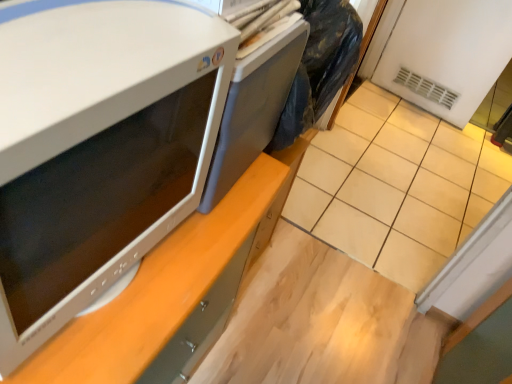
This screenshot has width=512, height=384. Describe the element at coordinates (97, 147) in the screenshot. I see `white glossy microwave at left` at that location.

Where is `beige tile at lower right`? This screenshot has height=384, width=512. beige tile at lower right is located at coordinates (396, 186).

How different are the orientations of satin gray desktop at center and beige tile at lower right in degrees?

There is a 89.8-degree angle between the facing directions of satin gray desktop at center and beige tile at lower right.

Can you confirm if satin gray desktop at center is smaller than beige tile at lower right?

Yes.

Which point is more distant from viewer, (211,163) or (329,192)?

Positioned behind is point (329,192).

Can beige tile at lower right be found inside satin gray desktop at center?

No, beige tile at lower right is not inside satin gray desktop at center.

Is white glossy microwave at left situated inside beige tile at lower right or outside?

white glossy microwave at left is not enclosed by beige tile at lower right.

Is point (9, 115) closer to camera compared to point (445, 191)?

Yes, it is in front of point (445, 191).

Between white glossy microwave at left and beige tile at lower right, which one has larger width?

Wider between the two is white glossy microwave at left.

Consider the image. Is white glossy microwave at left positioned behind beige tile at lower right?

No.

Between white glossy microwave at left and satin gray desktop at center, which one has larger width?

satin gray desktop at center is wider.

Is white glossy microwave at left turned away from satin gray desktop at center?

No, satin gray desktop at center is not at the back of white glossy microwave at left.

Which object is closer to the camera, white glossy microwave at left or satin gray desktop at center?

white glossy microwave at left.

Is beige tile at lower right far away from satin gray desktop at center?

beige tile at lower right is positioned a significant distance from satin gray desktop at center.

In the scene shown: Considering the relative sizes of beige tile at lower right and satin gray desktop at center in the image provided, is beige tile at lower right smaller than satin gray desktop at center?

No, beige tile at lower right is not smaller than satin gray desktop at center.

From a real-world perspective, is beige tile at lower right positioned under satin gray desktop at center based on gravity?

Yes, from a real-world perspective, beige tile at lower right is under satin gray desktop at center.

Considering the positions of points (284, 98) and (78, 3), is point (284, 98) closer to camera compared to point (78, 3)?

No, it is not.

Locate an element on the screen. desktop below the white glossy microwave at left (from a real-world perspective) is located at coordinates (253, 109).

Which object is more forward, satin gray desktop at center or white glossy microwave at left?

white glossy microwave at left.

Considering the positions of objects beige tile at lower right and white glossy microwave at left in the image provided, who is behind, beige tile at lower right or white glossy microwave at left?

beige tile at lower right is behind.

Could you tell me if beige tile at lower right is turned towards white glossy microwave at left?

Yes, beige tile at lower right faces towards white glossy microwave at left.

In the scene shown: Between beige tile at lower right and white glossy microwave at left, which one appears on the right side from the viewer's perspective?

beige tile at lower right.

Considering the relative sizes of beige tile at lower right and white glossy microwave at left in the image provided, is beige tile at lower right thinner than white glossy microwave at left?

Indeed, beige tile at lower right has a lesser width compared to white glossy microwave at left.

I want to click on desktop on the left of beige tile at lower right, so click(253, 109).

Where is `tile below the white glossy microwave at left (from a real-world perspective)`? tile below the white glossy microwave at left (from a real-world perspective) is located at coordinates (396, 186).

From the image, which object appears to be nearer to beige tile at lower right, satin gray desktop at center or white glossy microwave at left?

The object closer to beige tile at lower right is satin gray desktop at center.

When comparing their distances from white glossy microwave at left, does beige tile at lower right or satin gray desktop at center seem closer?

The object closer to white glossy microwave at left is satin gray desktop at center.

Considering their positions, is white glossy microwave at left positioned further to beige tile at lower right than satin gray desktop at center?

The object further to beige tile at lower right is white glossy microwave at left.

Looking at the image, which one is located further to satin gray desktop at center, white glossy microwave at left or beige tile at lower right?

Based on the image, beige tile at lower right appears to be further to satin gray desktop at center.

Considering their positions, is beige tile at lower right positioned further to satin gray desktop at center than white glossy microwave at left?

beige tile at lower right is further to satin gray desktop at center.

When comparing their distances from white glossy microwave at left, does satin gray desktop at center or beige tile at lower right seem further?

beige tile at lower right lies further to white glossy microwave at left than the other object.

This screenshot has width=512, height=384. Identify the location of desktop located between white glossy microwave at left and beige tile at lower right in the left-right direction. (253, 109).